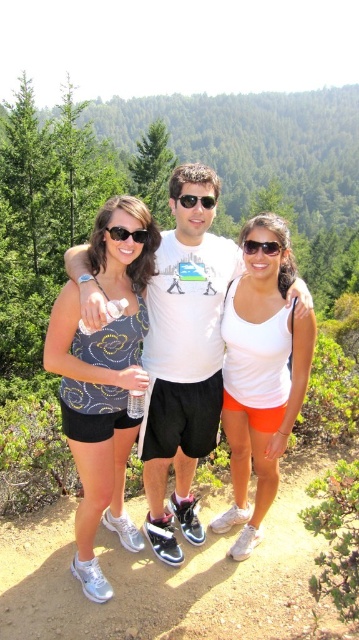
Is matte blue tank top at center below black plastic sunglasses at center?

Yes.

Who is more forward, [128,244] or [193,205]?

Positioned in front is point [128,244].

Does point (68, 333) come farther from viewer compared to point (185, 198)?

That is False.

I want to click on matte blue tank top at center, so click(103, 381).

Does white matte t-shirt at center have a larger size compared to white plastic sunglasses at center?

Indeed, white matte t-shirt at center has a larger size compared to white plastic sunglasses at center.

Which is in front, point (98, 296) or point (267, 253)?

Point (98, 296) is in front.

Where is `white matte t-shirt at center`? white matte t-shirt at center is located at coordinates (x=184, y=355).

From the picture: Which is below, white plastic sunglasses at center or matte black sunglasses at center?

white plastic sunglasses at center is lower down.

Can you confirm if white plastic sunglasses at center is thinner than matte black sunglasses at center?

Yes, white plastic sunglasses at center is thinner than matte black sunglasses at center.

What do you see at coordinates (260, 246) in the screenshot? This screenshot has height=640, width=359. I see `white plastic sunglasses at center` at bounding box center [260, 246].

Locate an element on the screen. The height and width of the screenshot is (640, 359). white plastic sunglasses at center is located at coordinates (260, 246).